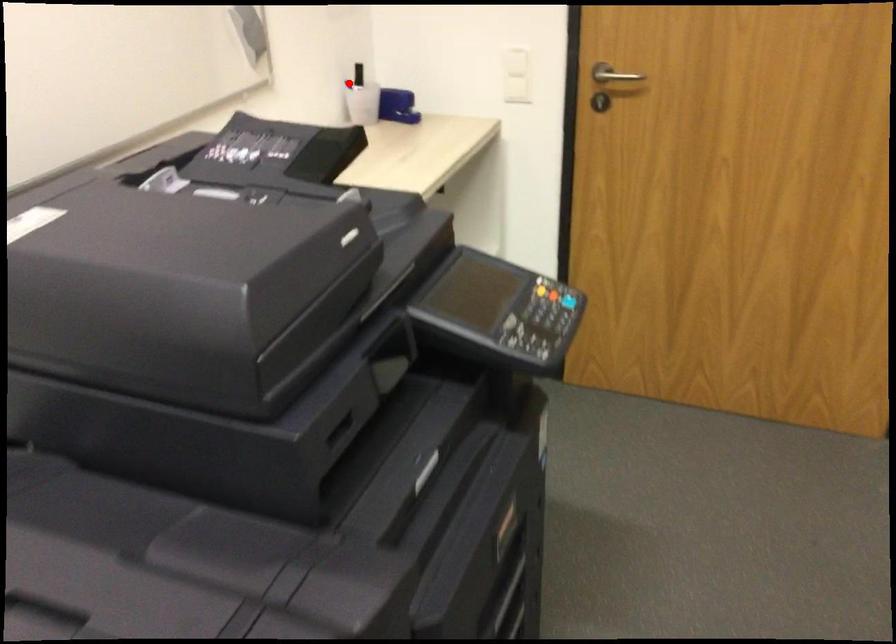
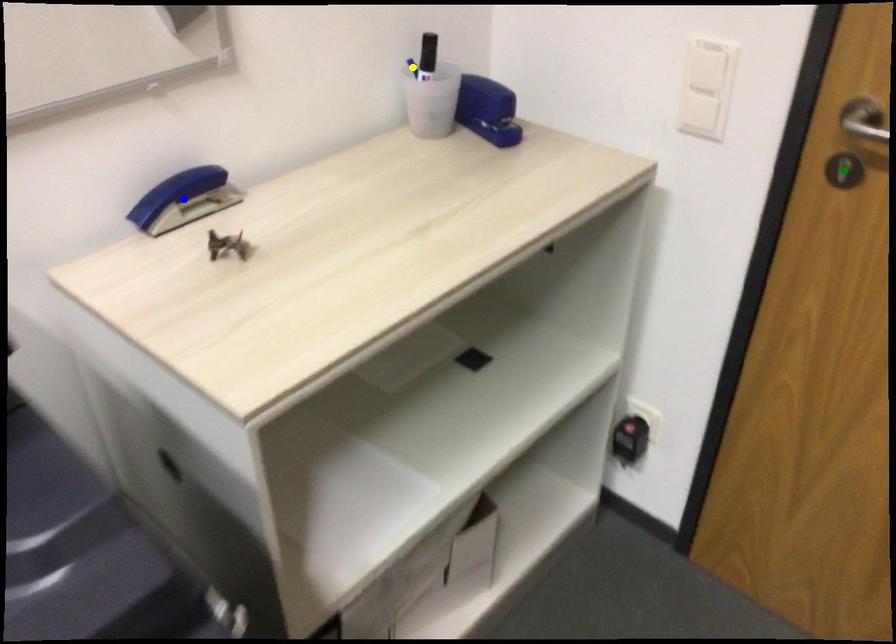
Question: I am providing you with two images of the same scene from different viewpoints. A red point is marked on the first image. You are given multiple points on the second image. Which point in image 2 is actually the same real-world point as the red point in image 1?

Choices:
 (A) yellow point
 (B) blue point
 (C) green point

Answer: (A)